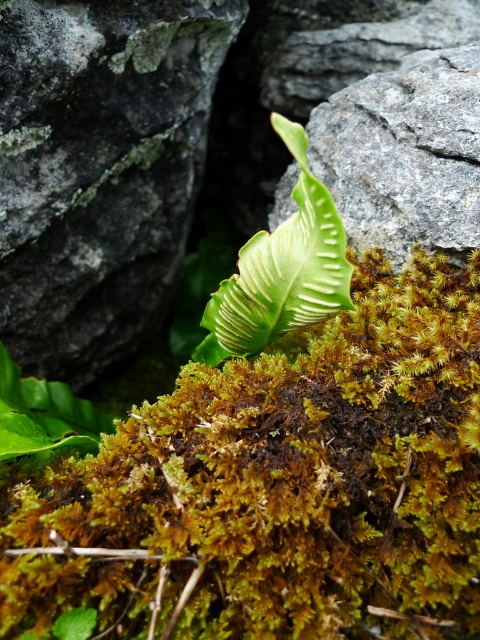
What is the object located at the coordinates point (99, 170) in the scene?

The object located at point (99, 170) is a gray rough boulder at center.

Consider the image. You are a hiker trying to place a small camping item on the ground between the gray rough boulder at center and the green matte leaf at center. Which object should you avoid placing it near if you want the item to be visible from above?

You should avoid placing the item near the gray rough boulder at center because it is larger than the green matte leaf at center, making it harder to see from above.

You are a geologist examining the image and need to locate the gray rough boulder at center. According to the coordinates provided, where exactly is it positioned?

The gray rough boulder at center is located at point coordinates of (99, 170).